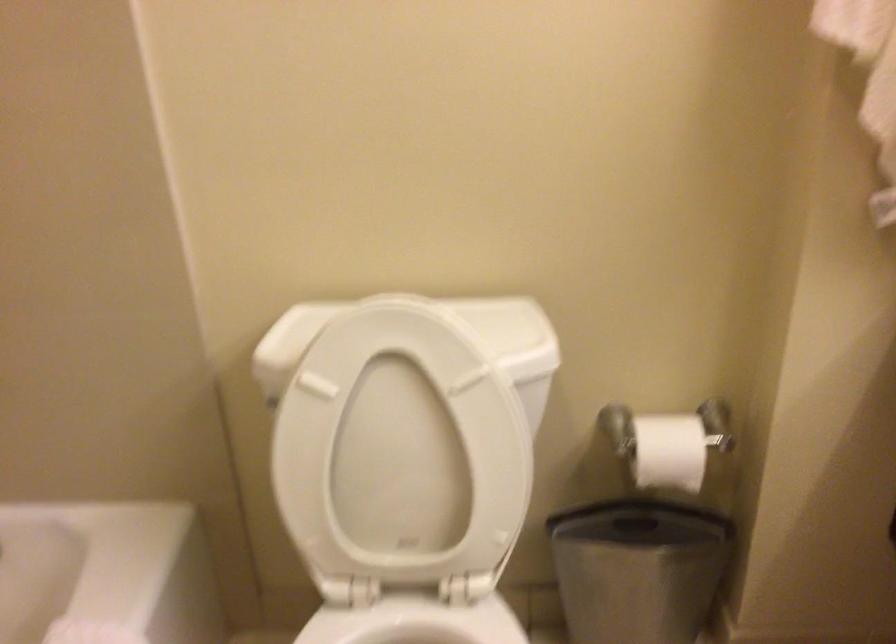
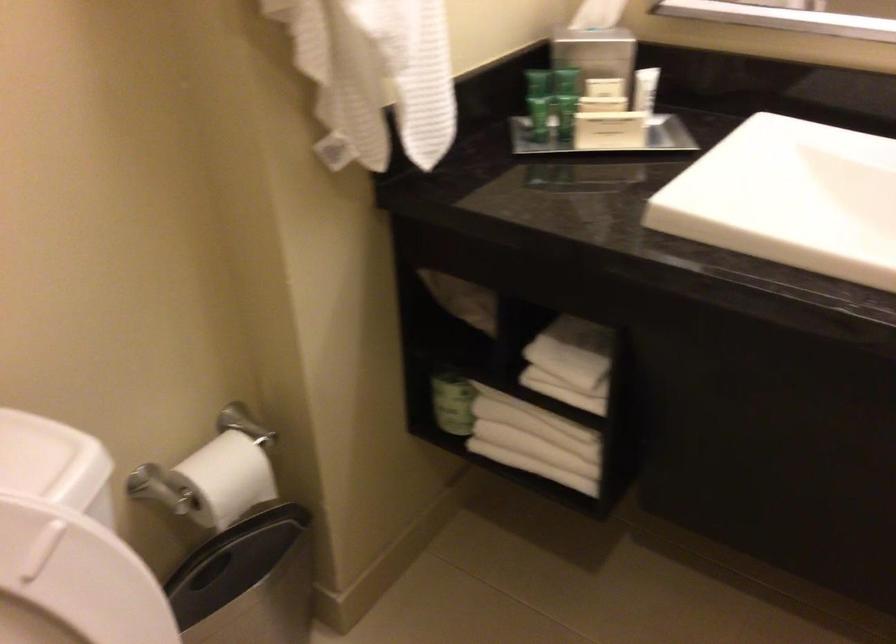
Find the pixel in the second image that matches point 665,556 in the first image.

(247, 582)